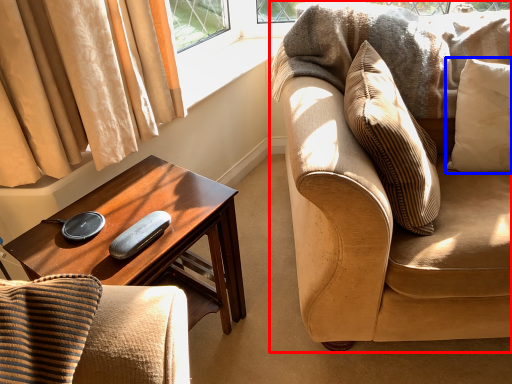
Question: Which of the following is the farthest to the observer, studio couch (highlighted by a red box) or pillow (highlighted by a blue box)?

Choices:
 (A) studio couch
 (B) pillow

Answer: (B)